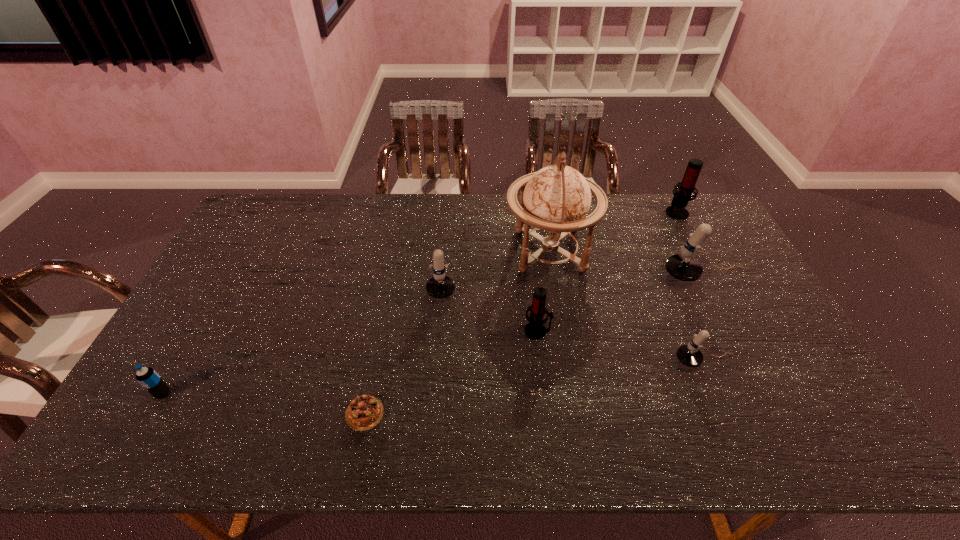
Identify the location of soda bottle. The image size is (960, 540). (147, 377).

Image resolution: width=960 pixels, height=540 pixels. In order to click on the seventh object from right to left in this screenshot , I will do `click(364, 412)`.

Identify the location of chocolate cake. (364, 412).

Locate an element on the screen. The height and width of the screenshot is (540, 960). blank area located 0.240m on the front-facing side of the globe is located at coordinates (433, 250).

Where is `vacant position located on the front-facing side of the globe`? vacant position located on the front-facing side of the globe is located at coordinates (x=477, y=250).

In order to click on free space located 0.070m on the front-facing side of the globe in this screenshot , I will do `click(483, 250)`.

The height and width of the screenshot is (540, 960). What are the coordinates of `blank space located 0.310m on the front of the right red microphone` in the screenshot? It's located at (712, 280).

This screenshot has width=960, height=540. I want to click on free spot located 0.370m on the back of the biggest white microphone, so click(666, 198).

Locate an element on the screen. This screenshot has height=540, width=960. vacant space located 0.220m on the left of the third object from left to right is located at coordinates (359, 278).

This screenshot has width=960, height=540. Find the location of `free space located 0.220m on the right of the nearer red microphone`. free space located 0.220m on the right of the nearer red microphone is located at coordinates (629, 330).